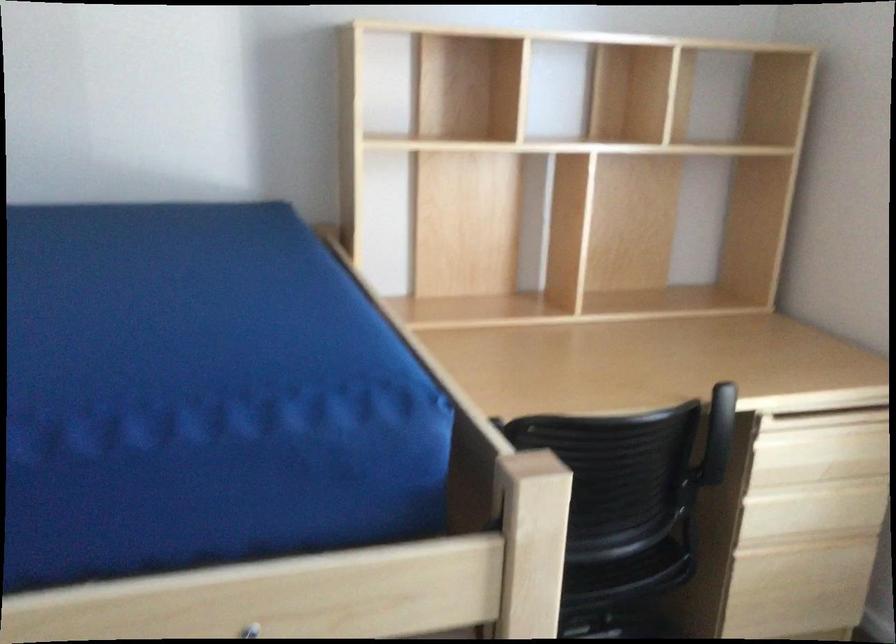
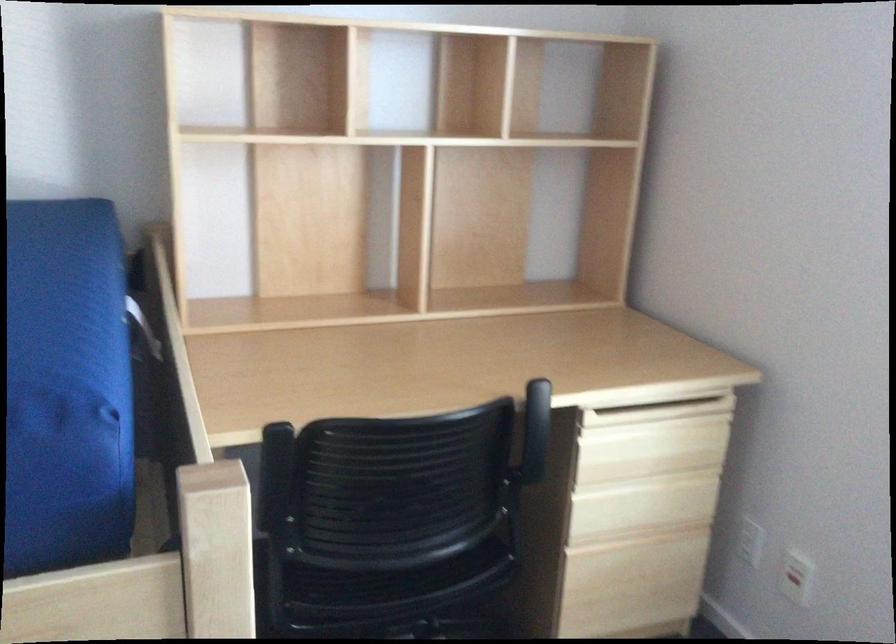
Question: Which direction would the cameraman need to move to produce the second image? Reply with the corresponding letter.

Choices:
 (A) Left
 (B) Right
 (C) Forward
 (D) Backward

Answer: (B)